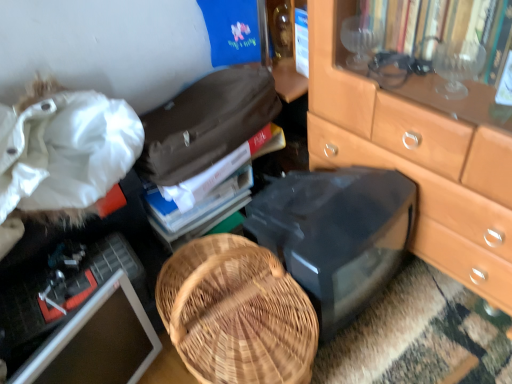
Question: From a real-world perspective, is white fabric at upper left located higher than black plastic desktop at center?

Choices:
 (A) yes
 (B) no

Answer: (A)

Question: Is white fabric at upper left next to black plastic desktop at center?

Choices:
 (A) yes
 (B) no

Answer: (B)

Question: Is the position of white fabric at upper left more distant than that of black plastic desktop at center?

Choices:
 (A) no
 (B) yes

Answer: (A)

Question: Is white fabric at upper left thinner than black plastic desktop at center?

Choices:
 (A) yes
 (B) no

Answer: (B)

Question: Can you confirm if white fabric at upper left is smaller than black plastic desktop at center?

Choices:
 (A) yes
 (B) no

Answer: (B)

Question: Considering the positions of white fabric at upper left and matte black computer monitor at lower left in the image, is white fabric at upper left taller or shorter than matte black computer monitor at lower left?

Choices:
 (A) short
 (B) tall

Answer: (B)

Question: Is point (15, 71) positioned closer to the camera than point (142, 362)?

Choices:
 (A) closer
 (B) farther

Answer: (A)

Question: Is white fabric at upper left wider or thinner than matte black computer monitor at lower left?

Choices:
 (A) thin
 (B) wide

Answer: (B)

Question: From the image's perspective, is white fabric at upper left located above or below matte black computer monitor at lower left?

Choices:
 (A) above
 (B) below

Answer: (A)

Question: Would you say white fabric at upper left is to the left or to the right of hardcover book at center in the picture?

Choices:
 (A) right
 (B) left

Answer: (B)

Question: Choose the correct answer: Is white fabric at upper left inside hardcover book at center or outside it?

Choices:
 (A) outside
 (B) inside

Answer: (A)

Question: Looking at the image, does white fabric at upper left seem bigger or smaller compared to hardcover book at center?

Choices:
 (A) small
 (B) big

Answer: (B)

Question: From the image's perspective, is white fabric at upper left above or below hardcover book at center?

Choices:
 (A) above
 (B) below

Answer: (B)

Question: Which is correct: hardcover book at center is inside matte black computer monitor at lower left, or outside of it?

Choices:
 (A) outside
 (B) inside

Answer: (A)

Question: Based on their sizes in the image, would you say hardcover book at center is bigger or smaller than matte black computer monitor at lower left?

Choices:
 (A) big
 (B) small

Answer: (B)